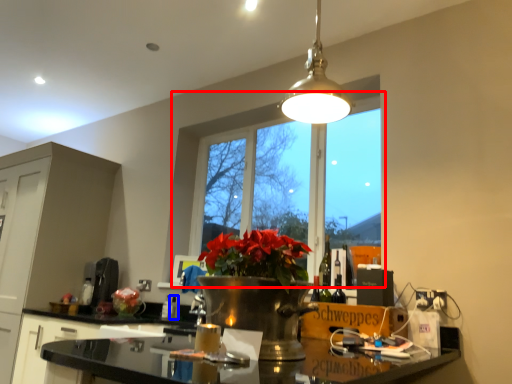
Question: Which object is further to the camera taking this photo, window (highlighted by a red box) or bottle (highlighted by a blue box)?

Choices:
 (A) window
 (B) bottle

Answer: (B)